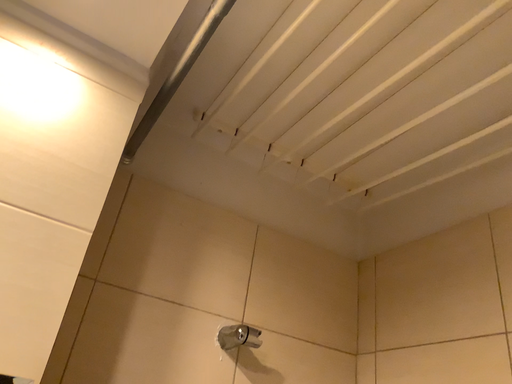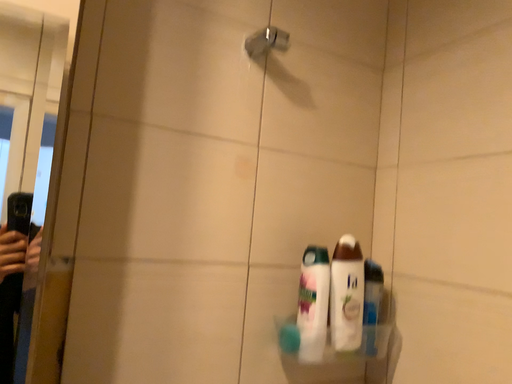
Question: How did the camera likely rotate when shooting the video?

Choices:
 (A) rotated upward
 (B) rotated downward

Answer: (B)